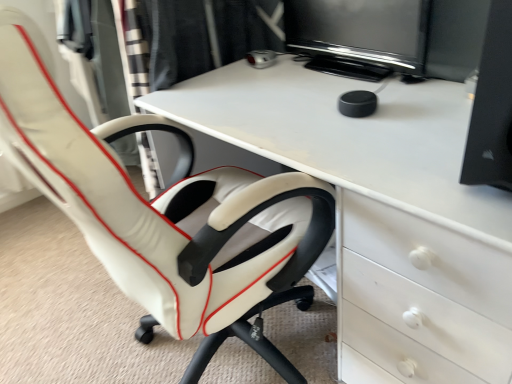
Question: Is black glossy monitor at upper center positioned beyond the bounds of white glossy desk at center?

Choices:
 (A) no
 (B) yes

Answer: (B)

Question: Considering the relative positions of black glossy monitor at upper center and white glossy desk at center in the image provided, is black glossy monitor at upper center to the right of white glossy desk at center from the viewer's perspective?

Choices:
 (A) no
 (B) yes

Answer: (B)

Question: Is black glossy monitor at upper center wider than white glossy desk at center?

Choices:
 (A) yes
 (B) no

Answer: (B)

Question: Is black glossy monitor at upper center further to camera compared to white glossy desk at center?

Choices:
 (A) no
 (B) yes

Answer: (B)

Question: Is black glossy monitor at upper center in front of white glossy desk at center?

Choices:
 (A) no
 (B) yes

Answer: (A)

Question: Is black glossy monitor at upper center in front of or behind white leather chair at left in the image?

Choices:
 (A) front
 (B) behind

Answer: (B)

Question: Considering the positions of black glossy monitor at upper center and white leather chair at left in the image, is black glossy monitor at upper center wider or thinner than white leather chair at left?

Choices:
 (A) thin
 (B) wide

Answer: (A)

Question: Considering the relative positions of black glossy monitor at upper center and white leather chair at left in the image provided, is black glossy monitor at upper center to the left or to the right of white leather chair at left?

Choices:
 (A) left
 (B) right

Answer: (B)

Question: From the image's perspective, is black glossy monitor at upper center positioned above or below white leather chair at left?

Choices:
 (A) above
 (B) below

Answer: (A)

Question: Considering the positions of white glossy desk at center and white leather chair at left in the image, is white glossy desk at center taller or shorter than white leather chair at left?

Choices:
 (A) tall
 (B) short

Answer: (B)

Question: Looking at the image, does white glossy desk at center seem bigger or smaller compared to white leather chair at left?

Choices:
 (A) big
 (B) small

Answer: (A)

Question: Is white glossy desk at center wider or thinner than white leather chair at left?

Choices:
 (A) wide
 (B) thin

Answer: (B)

Question: Is white glossy desk at center spatially inside white leather chair at left, or outside of it?

Choices:
 (A) inside
 (B) outside

Answer: (B)

Question: Considering the positions of white leather chair at left and white glossy desk at center in the image, is white leather chair at left taller or shorter than white glossy desk at center?

Choices:
 (A) tall
 (B) short

Answer: (A)

Question: Considering the positions of point (185, 180) and point (231, 104), is point (185, 180) closer or farther from the camera than point (231, 104)?

Choices:
 (A) closer
 (B) farther

Answer: (B)